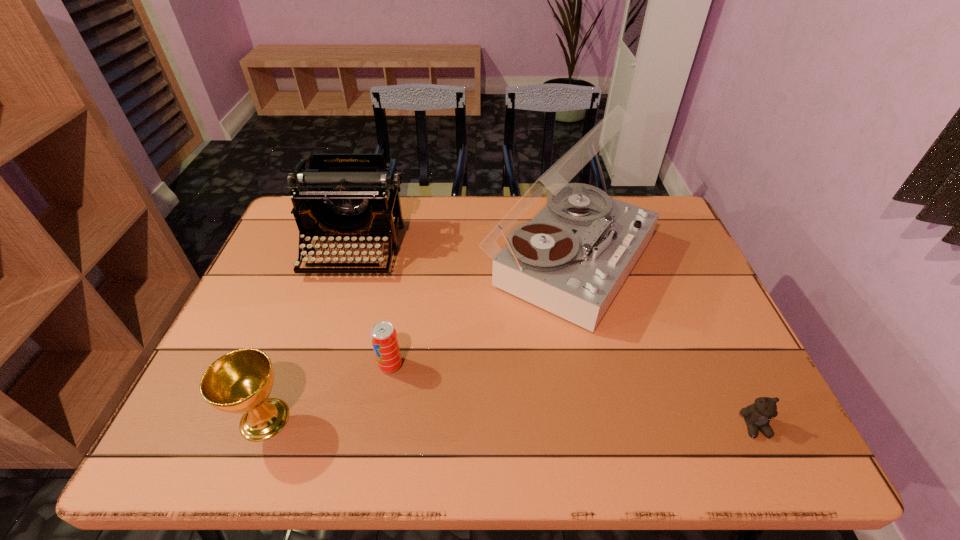
Find the location of a particular element. This screenshot has width=960, height=540. object located at the far left corner is located at coordinates (346, 197).

The height and width of the screenshot is (540, 960). Find the location of `object located in the near left corner section of the desktop`. object located in the near left corner section of the desktop is located at coordinates (240, 381).

You are a GUI agent. You are given a task and a screenshot of the screen. Output one action in this format:
    pyautogui.click(x=<x>, y=<y>)
    Task: Click on the object positioned at the far right corner
    
    Given the screenshot: What is the action you would take?
    pyautogui.click(x=572, y=258)

Where is `object that is at the near right corner`? The image size is (960, 540). object that is at the near right corner is located at coordinates (757, 416).

Identify the location of vacant area at the far edge. (363, 237).

Where is `free location at the near edge`? This screenshot has height=540, width=960. free location at the near edge is located at coordinates (556, 437).

Find the location of `vacant region at the left edge`. vacant region at the left edge is located at coordinates (234, 332).

The width and height of the screenshot is (960, 540). In order to click on vacant space at the right edge in this screenshot , I will do `click(752, 396)`.

Identify the location of vacant space at the far right corner of the desktop. (661, 202).

Find the location of a particular element. free area in between the second object from right to left and the third nearest object is located at coordinates (480, 313).